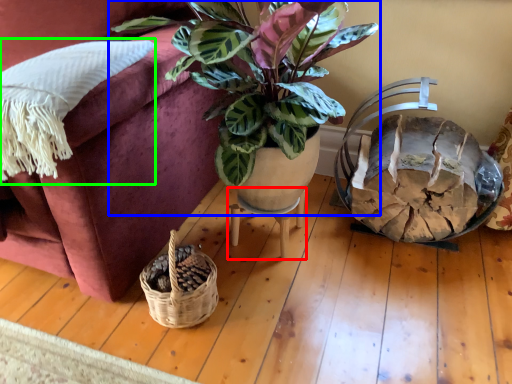
Question: Considering the real-world distances, which object is farthest from table (highlighted by a red box)? houseplant (highlighted by a blue box) or pillow (highlighted by a green box)?

Choices:
 (A) houseplant
 (B) pillow

Answer: (B)